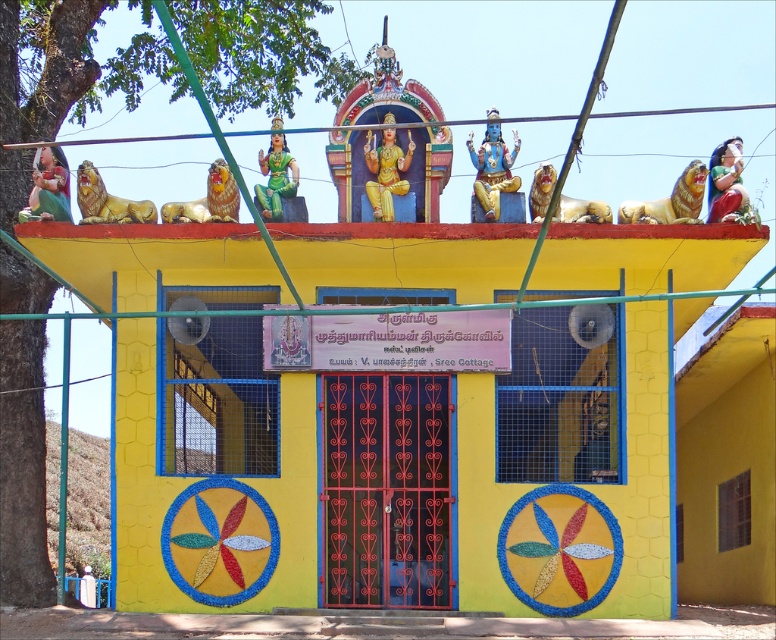
You are standing in front of the temple and want to place a small offering on the statue that is lower down. Which statue should you choose between the green glossy statue at center and the matte green statue at left?

The matte green statue at left is lower down, so you should choose the matte green statue at left to place your offering.

You are visiting this temple and want to place a small offering at the base of the taller statue between the green glossy statue at center and the matte green statue at left. Which statue should you approach?

The green glossy statue at center is taller than the matte green statue at left, so you should approach the green glossy statue at center to place your offering.

You are an architect designing a new temple. You have two statues to place in front of the entrance gates. The green glossy statue at center and the matte green statue at left. Which statue should you place closer to the entrance gates if you want the larger one to be more prominent?

The green glossy statue at center is larger in size than the matte green statue at left. To make the larger one more prominent, place the green glossy statue at center closer to the entrance gates so it can be seen first upon approaching.